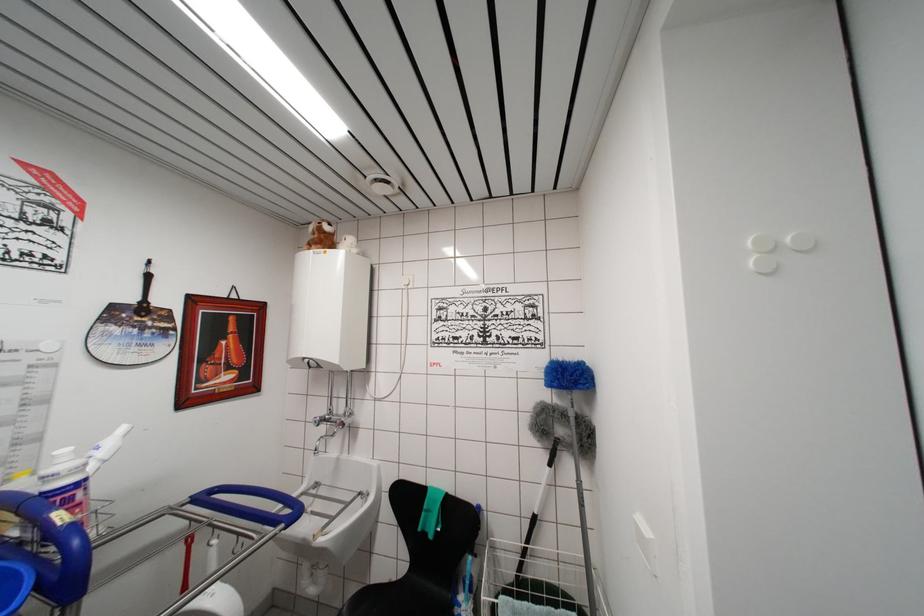
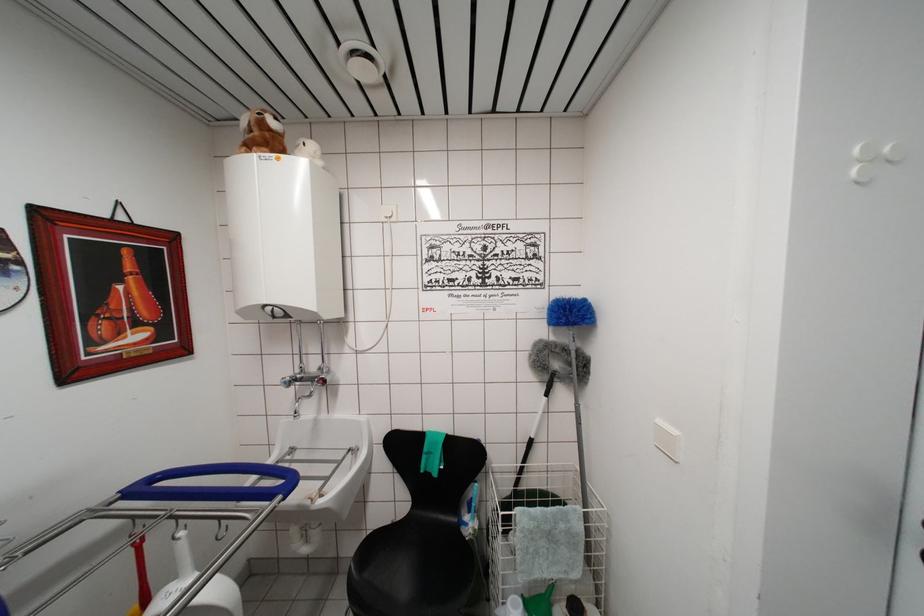
Question: Based on the continuous images, in which direction is the camera rotating? Reply with the corresponding letter.

Choices:
 (A) Left
 (B) Right
 (C) Up
 (D) Down

Answer: (B)